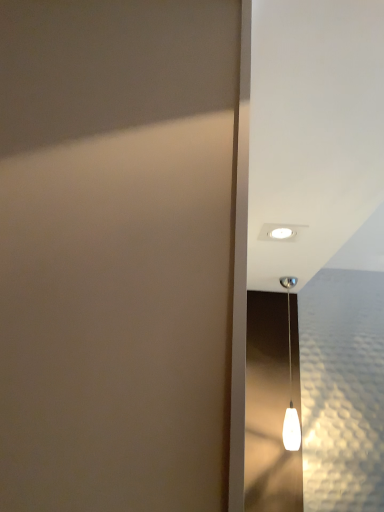
Find the location of a particular element. This screenshot has width=384, height=512. white frosted glass pendant light at upper right is located at coordinates (290, 387).

Describe the element at coordinates (290, 387) in the screenshot. I see `white frosted glass pendant light at upper right` at that location.

Locate an element on the screen. white frosted glass pendant light at upper right is located at coordinates (290, 387).